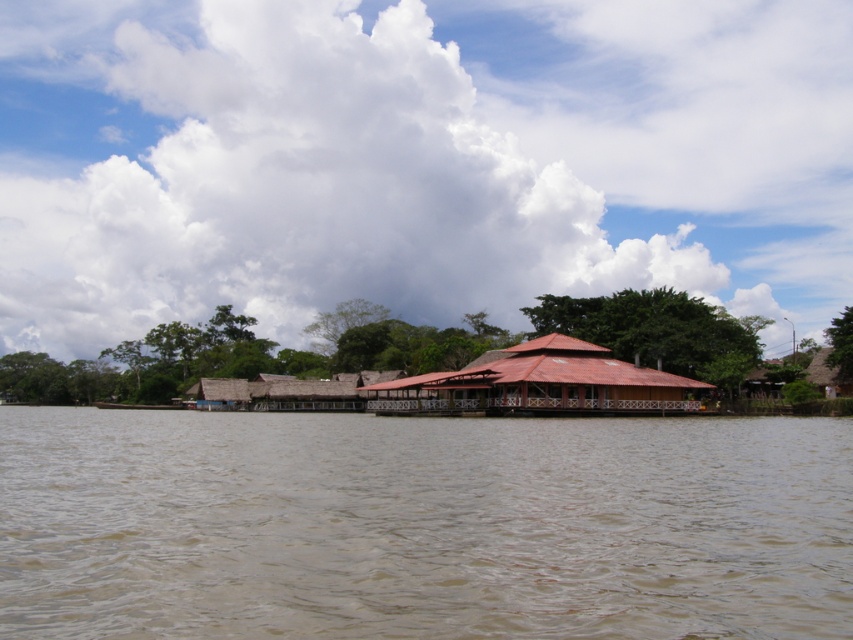
Question: Which of the following is the farthest from the observer?

Choices:
 (A) (224, 600)
 (B) (682, 380)

Answer: (B)

Question: Is brown muddy water at center bigger than red thatched hut at center?

Choices:
 (A) no
 (B) yes

Answer: (B)

Question: Does brown muddy water at center appear over red thatched hut at center?

Choices:
 (A) no
 (B) yes

Answer: (A)

Question: Where is brown muddy water at center located in relation to red thatched hut at center in the image?

Choices:
 (A) right
 (B) left

Answer: (B)